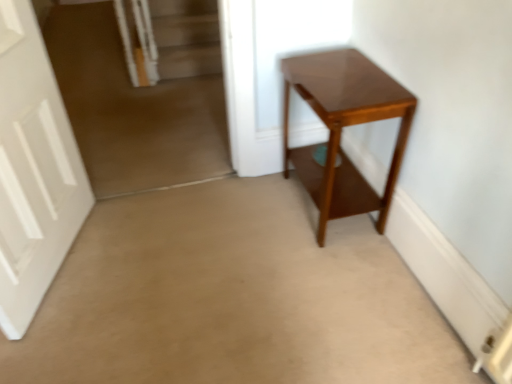
Question: From the image's perspective, does glossy wood table at center appear higher than white matte door at left?

Choices:
 (A) no
 (B) yes

Answer: (B)

Question: Is the depth of glossy wood table at center less than that of white matte door at left?

Choices:
 (A) no
 (B) yes

Answer: (A)

Question: Are glossy wood table at center and white matte door at left located far from each other?

Choices:
 (A) yes
 (B) no

Answer: (A)

Question: From a real-world perspective, is glossy wood table at center physically below white matte door at left?

Choices:
 (A) no
 (B) yes

Answer: (B)

Question: Is glossy wood table at center to the right of white matte door at left from the viewer's perspective?

Choices:
 (A) yes
 (B) no

Answer: (A)

Question: From a real-world perspective, is glossy wood table at center positioned over white matte door at left based on gravity?

Choices:
 (A) no
 (B) yes

Answer: (A)

Question: Considering the relative sizes of white matte door at left and glossy wood table at center in the image provided, is white matte door at left thinner than glossy wood table at center?

Choices:
 (A) no
 (B) yes

Answer: (B)

Question: Is white matte door at left directly adjacent to glossy wood table at center?

Choices:
 (A) yes
 (B) no

Answer: (B)

Question: Considering the relative sizes of white matte door at left and glossy wood table at center in the image provided, is white matte door at left smaller than glossy wood table at center?

Choices:
 (A) no
 (B) yes

Answer: (B)

Question: Is white matte door at left at the right side of glossy wood table at center?

Choices:
 (A) yes
 (B) no

Answer: (B)

Question: Is glossy wood table at center completely or partially inside white matte door at left?

Choices:
 (A) yes
 (B) no

Answer: (B)

Question: Does white matte door at left have a greater height compared to glossy wood table at center?

Choices:
 (A) no
 (B) yes

Answer: (B)

Question: In terms of width, does glossy wood table at center look wider or thinner when compared to white matte door at left?

Choices:
 (A) wide
 (B) thin

Answer: (A)